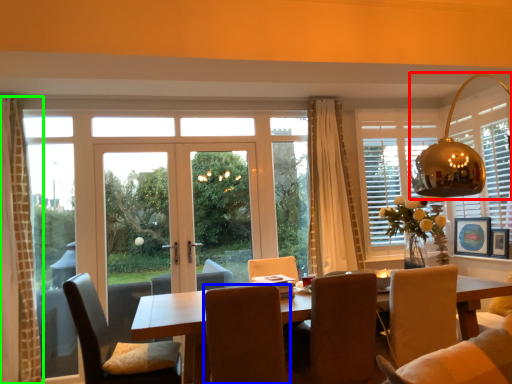
Question: Which object is the closest to the light fixture (highlighted by a red box)? Choose among these: chair (highlighted by a blue box) or curtain (highlighted by a green box).

Choices:
 (A) chair
 (B) curtain

Answer: (A)